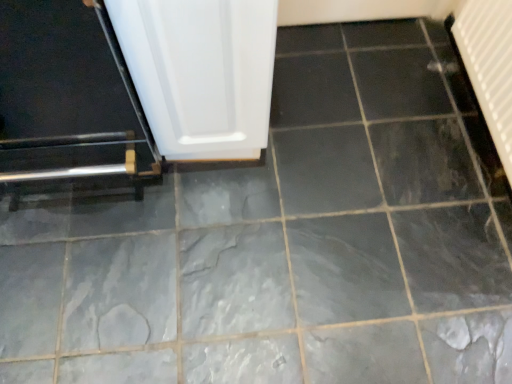
Question: Does metallic silver door at left come behind white textured radiator at upper right?

Choices:
 (A) yes
 (B) no

Answer: (B)

Question: From a real-world perspective, is metallic silver door at left located higher than white textured radiator at upper right?

Choices:
 (A) no
 (B) yes

Answer: (B)

Question: Can you confirm if metallic silver door at left is positioned to the right of white textured radiator at upper right?

Choices:
 (A) no
 (B) yes

Answer: (A)

Question: Is metallic silver door at left facing away from white textured radiator at upper right?

Choices:
 (A) yes
 (B) no

Answer: (B)

Question: Does metallic silver door at left have a lesser height compared to white textured radiator at upper right?

Choices:
 (A) yes
 (B) no

Answer: (B)

Question: Relative to white glossy door at center, is white textured radiator at upper right in front or behind?

Choices:
 (A) behind
 (B) front

Answer: (A)

Question: Considering the positions of white textured radiator at upper right and white glossy door at center in the image, is white textured radiator at upper right wider or thinner than white glossy door at center?

Choices:
 (A) wide
 (B) thin

Answer: (B)

Question: Is white textured radiator at upper right to the left or to the right of white glossy door at center in the image?

Choices:
 (A) right
 (B) left

Answer: (A)

Question: From their relative heights in the image, would you say white textured radiator at upper right is taller or shorter than white glossy door at center?

Choices:
 (A) short
 (B) tall

Answer: (A)

Question: Visually, is metallic silver door at left positioned to the left or to the right of white textured radiator at upper right?

Choices:
 (A) right
 (B) left

Answer: (B)

Question: In the image, is metallic silver door at left positioned in front of or behind white textured radiator at upper right?

Choices:
 (A) front
 (B) behind

Answer: (A)

Question: From a real-world perspective, is metallic silver door at left above or below white textured radiator at upper right?

Choices:
 (A) below
 (B) above

Answer: (B)

Question: Is metallic silver door at left situated inside white textured radiator at upper right or outside?

Choices:
 (A) outside
 (B) inside

Answer: (A)

Question: From a real-world perspective, is white glossy door at center above or below metallic silver door at left?

Choices:
 (A) below
 (B) above

Answer: (A)

Question: Considering the positions of white glossy door at center and metallic silver door at left in the image, is white glossy door at center taller or shorter than metallic silver door at left?

Choices:
 (A) tall
 (B) short

Answer: (B)